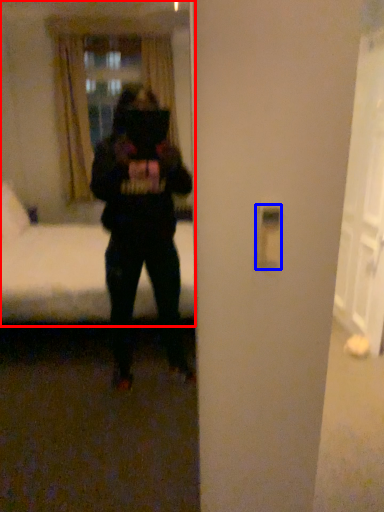
Question: Which object is closer to the camera taking this photo, mirror (highlighted by a red box) or light switch (highlighted by a blue box)?

Choices:
 (A) mirror
 (B) light switch

Answer: (A)